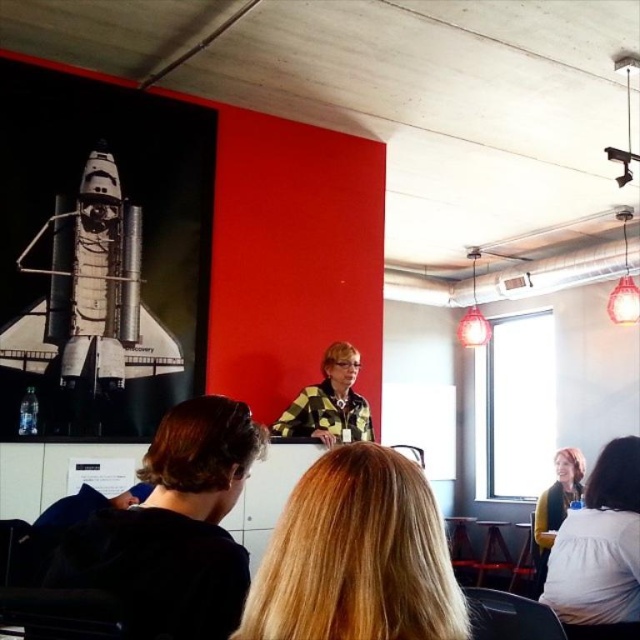
Question: Is metallic silver rocket at upper left positioned at the back of yellow checkered shirt at center?

Choices:
 (A) no
 (B) yes

Answer: (A)

Question: Is black fabric at lower left positioned in front of metallic silver rocket at upper left?

Choices:
 (A) yes
 (B) no

Answer: (A)

Question: Which point appears farthest from the camera in this image?

Choices:
 (A) (602, 573)
 (B) (147, 460)

Answer: (A)

Question: Which object is the farthest from the yellow-green sweater at lower right?

Choices:
 (A) blonde hair at center
 (B) black fabric at lower left

Answer: (A)

Question: Which object is the closest to the metallic silver rocket at upper left?

Choices:
 (A) blonde hair at center
 (B) yellow-green sweater at lower right

Answer: (A)

Question: Does yellow checkered shirt at center appear on the right side of yellow-green sweater at lower right?

Choices:
 (A) no
 (B) yes

Answer: (A)